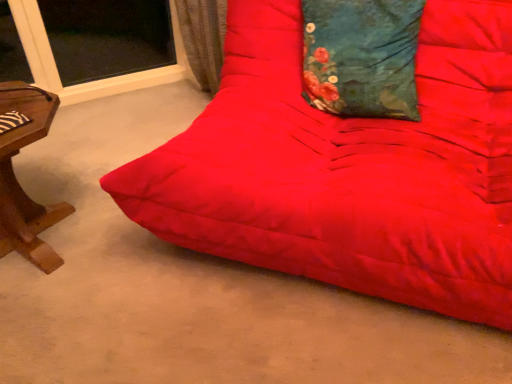
Question: Does teal floral fabric pillow at upper center lie in front of matte red futon at center?

Choices:
 (A) no
 (B) yes

Answer: (A)

Question: Is teal floral fabric pillow at upper center not inside matte red futon at center?

Choices:
 (A) yes
 (B) no

Answer: (B)

Question: Is teal floral fabric pillow at upper center wider than matte red futon at center?

Choices:
 (A) yes
 (B) no

Answer: (B)

Question: From a real-world perspective, is teal floral fabric pillow at upper center located beneath matte red futon at center?

Choices:
 (A) yes
 (B) no

Answer: (B)

Question: Can you confirm if teal floral fabric pillow at upper center is shorter than matte red futon at center?

Choices:
 (A) no
 (B) yes

Answer: (B)

Question: Are teal floral fabric pillow at upper center and matte red futon at center making contact?

Choices:
 (A) no
 (B) yes

Answer: (A)

Question: Does matte red futon at center touch teal floral fabric pillow at upper center?

Choices:
 (A) yes
 (B) no

Answer: (B)

Question: Does matte red futon at center appear on the right side of teal floral fabric pillow at upper center?

Choices:
 (A) no
 (B) yes

Answer: (A)

Question: From a real-world perspective, is matte red futon at center located higher than teal floral fabric pillow at upper center?

Choices:
 (A) yes
 (B) no

Answer: (B)

Question: From a real-world perspective, does matte red futon at center sit lower than teal floral fabric pillow at upper center?

Choices:
 (A) yes
 (B) no

Answer: (A)

Question: Considering the relative positions of matte red futon at center and teal floral fabric pillow at upper center in the image provided, is matte red futon at center in front of teal floral fabric pillow at upper center?

Choices:
 (A) yes
 (B) no

Answer: (A)

Question: From the image's perspective, would you say matte red futon at center is shown under teal floral fabric pillow at upper center?

Choices:
 (A) yes
 (B) no

Answer: (A)

Question: Relative to matte red futon at center, is teal floral fabric pillow at upper center in front or behind?

Choices:
 (A) front
 (B) behind

Answer: (B)